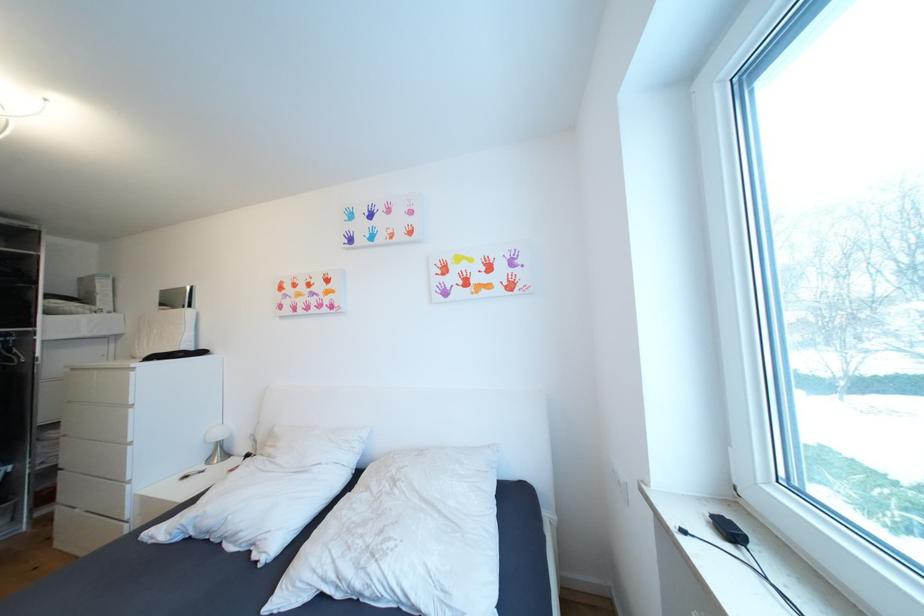
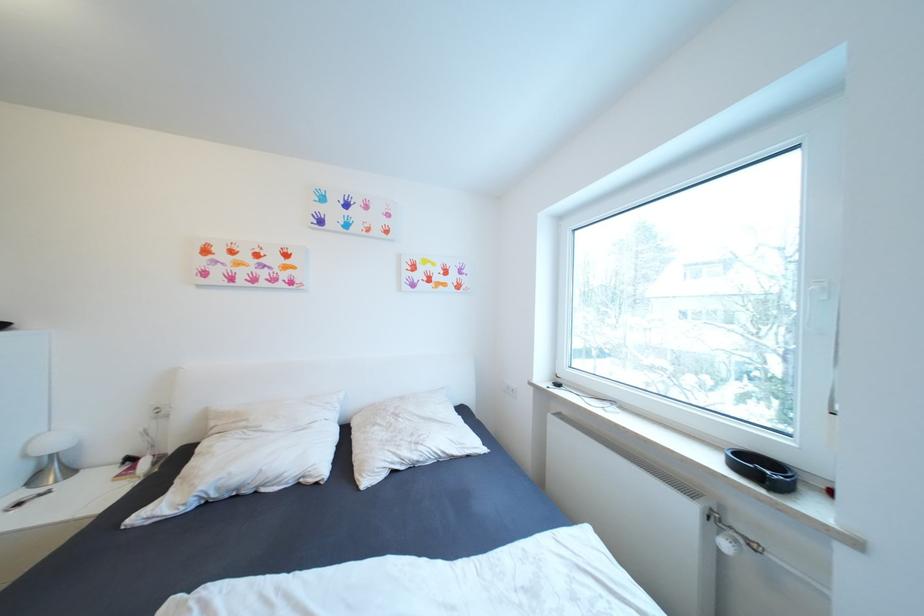
In the second image, find the point that corresponds to (225,436) in the first image.

(63, 445)